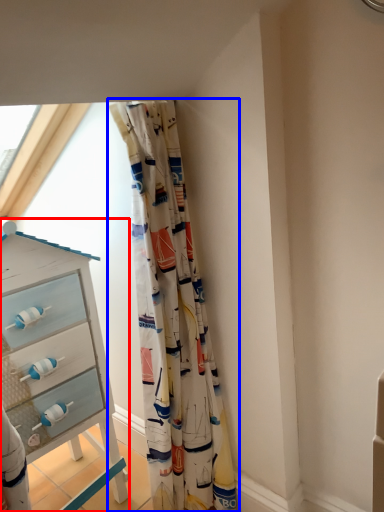
Question: Which point is closer to the camera, chest of drawers (highlighted by a red box) or curtain (highlighted by a blue box)?

Choices:
 (A) chest of drawers
 (B) curtain

Answer: (B)